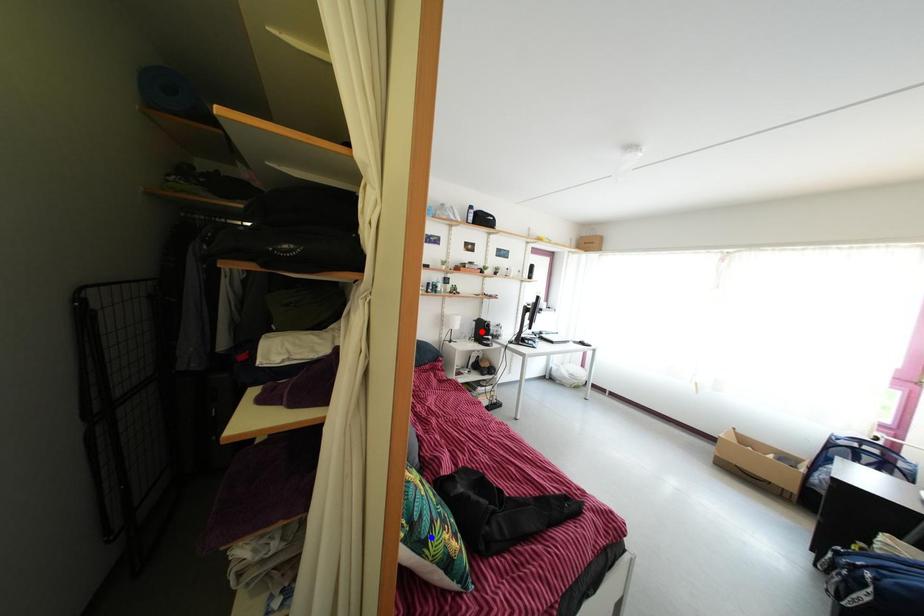
Question: Which of the two points in the image is closer to the camera?

Choices:
 (A) Blue point is closer.
 (B) Red point is closer.

Answer: (A)